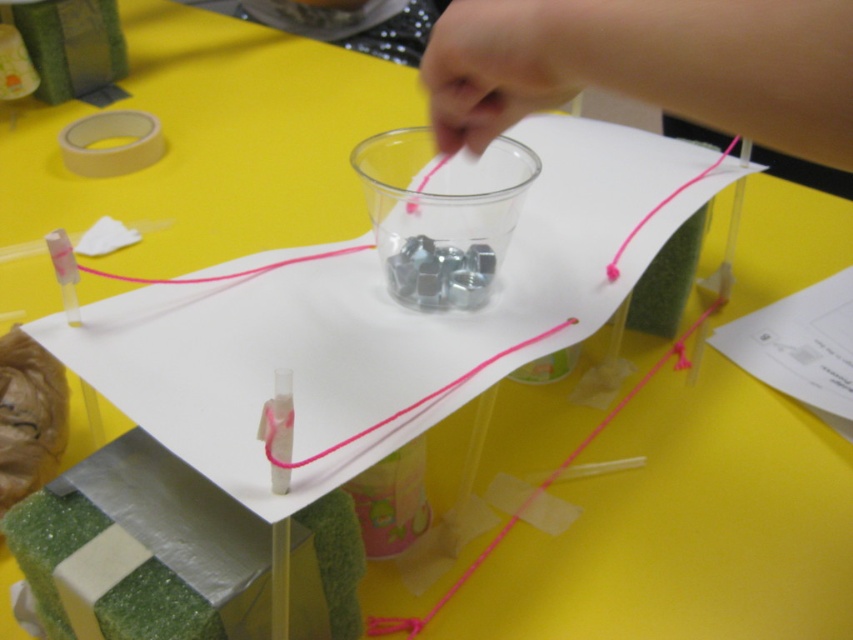
Question: Which of the following is the farthest from the observer?

Choices:
 (A) (67, 144)
 (B) (822, 180)
 (C) (343, 440)

Answer: (B)

Question: Is pink fabric hand at upper center thinner than pink string at center?

Choices:
 (A) no
 (B) yes

Answer: (B)

Question: Can you confirm if pink fabric hand at upper center is positioned above white matte tape at upper left?

Choices:
 (A) yes
 (B) no

Answer: (B)

Question: Which point is closer to the camera?

Choices:
 (A) pink fabric hand at upper center
 (B) pink string at center

Answer: (A)

Question: From the image, what is the correct spatial relationship of white matte tape at upper left in relation to pink string at center?

Choices:
 (A) below
 (B) above

Answer: (B)

Question: Which is farther from the white matte tape at upper left?

Choices:
 (A) pink fabric hand at upper center
 (B) pink string at center

Answer: (A)